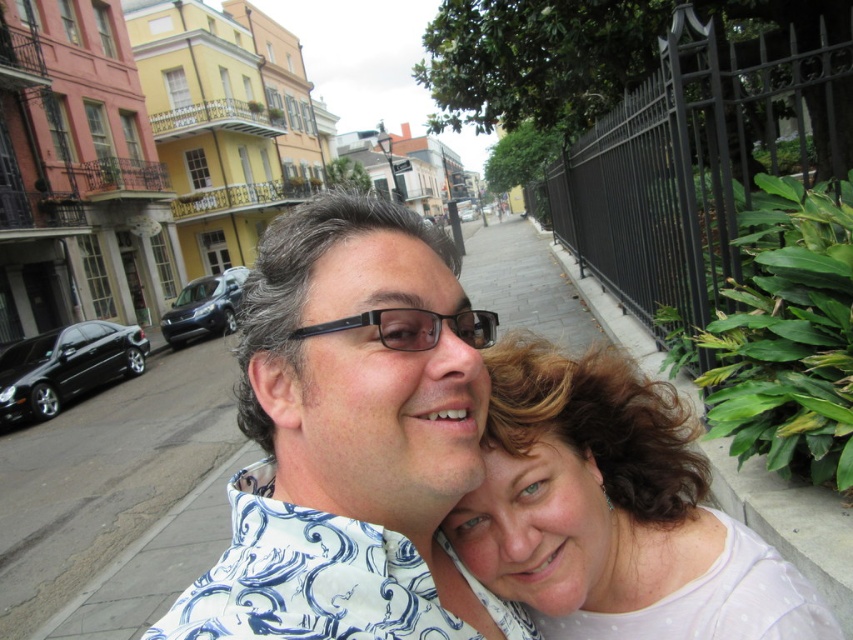
Question: Which object is closer to the camera taking this photo?

Choices:
 (A) white dotted shirt at center
 (B) black plastic glasses at center
 (C) white printed shirt at center

Answer: (C)

Question: Is white dotted shirt at center positioned before black plastic glasses at center?

Choices:
 (A) yes
 (B) no

Answer: (B)

Question: Among these objects, which one is farthest from the camera?

Choices:
 (A) black plastic glasses at center
 (B) white dotted shirt at center
 (C) white printed shirt at center

Answer: (B)

Question: Is white printed shirt at center bigger than white dotted shirt at center?

Choices:
 (A) no
 (B) yes

Answer: (A)

Question: In this image, where is white dotted shirt at center located relative to black plastic glasses at center?

Choices:
 (A) above
 (B) below

Answer: (B)

Question: Which point is farther from the camera taking this photo?

Choices:
 (A) (349, 362)
 (B) (410, 312)

Answer: (B)